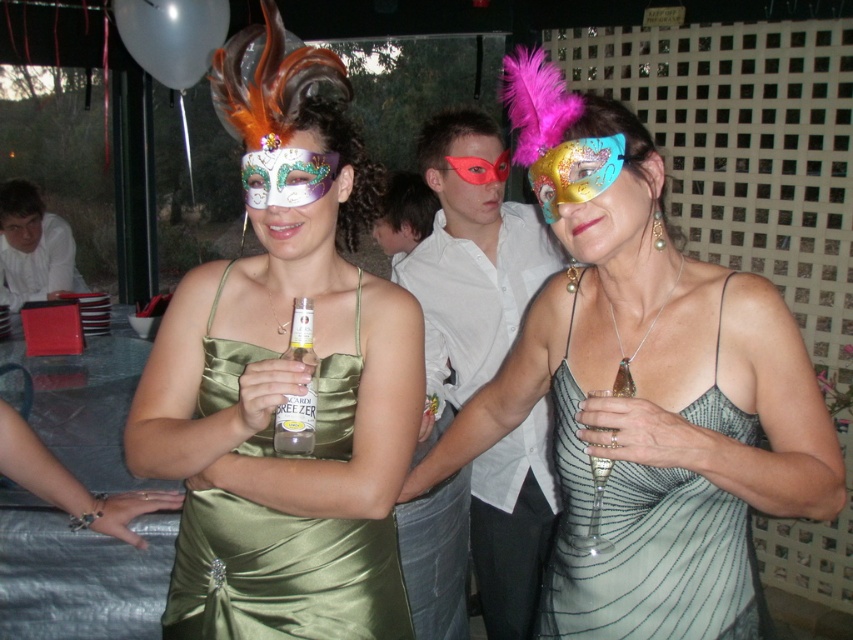
You are a photographer at the event and want to capture a photo that includes both the matte red mask at center and the matte white face at upper left. From the photographer perspective, which object should be positioned higher in the photo?

The matte white face at upper left should be positioned higher in the photo because the matte red mask at center is below it.

From the picture: You are standing in the center of the image and want to hand a gift to the metallic gold mask at center. In which direction should you move to reach it?

The metallic gold mask at center is located at point 0.269 on the x axis and 0.675 on the y axis. Since you are at the center of the image, which is point 0.5 on both axes, you should move to the left and down to reach the metallic gold mask at center.